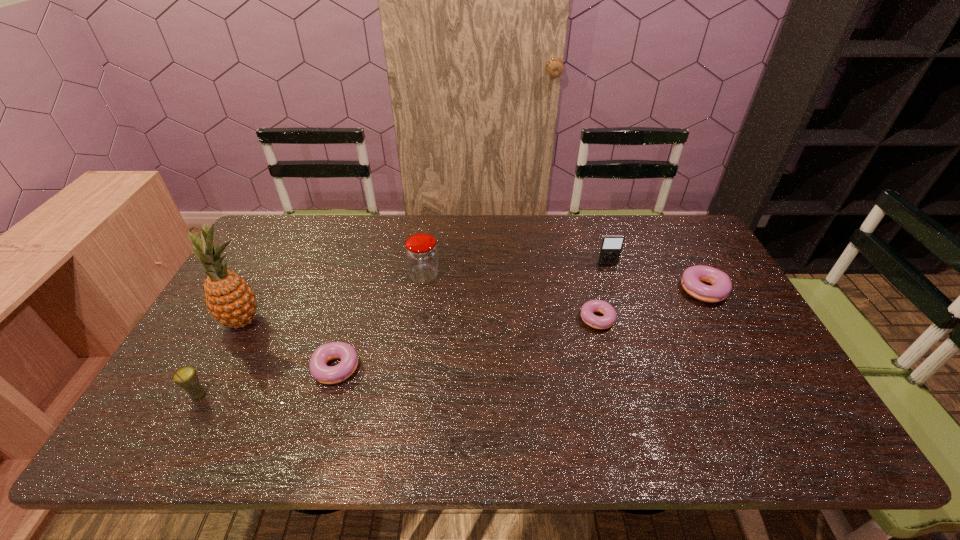
At what (x,y) coordinates should I click in order to perform the action: click on vacant space located 0.280m on the left of the nearest doughnut. Please return your answer as a coordinate pair (x, y). The width and height of the screenshot is (960, 540). Looking at the image, I should click on (203, 368).

Identify the location of free spot located on the left of the shortest doughnut. (488, 316).

This screenshot has height=540, width=960. I want to click on free space located 0.150m on the front of the rightmost doughnut, so click(x=740, y=357).

Where is `vacant region located on the right of the pineapple`? The width and height of the screenshot is (960, 540). vacant region located on the right of the pineapple is located at coordinates (346, 321).

You are a GUI agent. You are given a task and a screenshot of the screen. Output one action in this format:
    pyautogui.click(x=<x>, y=<y>)
    Task: Click on the vacant area situated 0.100m on the left of the jar
    Image resolution: width=960 pixels, height=540 pixels.
    Given the screenshot: What is the action you would take?
    pyautogui.click(x=377, y=276)

Locate an element on the screen. Image resolution: width=960 pixels, height=540 pixels. vacant area situated 0.240m on the front-facing side of the farthest object is located at coordinates (626, 320).

Where is `vacant space located 0.240m on the back of the straw for drinking`? Image resolution: width=960 pixels, height=540 pixels. vacant space located 0.240m on the back of the straw for drinking is located at coordinates coord(243,315).

At what (x,y) coordinates should I click in order to perform the action: click on doughnut at the near edge. Please return your answer as a coordinate pair (x, y). This screenshot has width=960, height=540. Looking at the image, I should click on (319, 370).

This screenshot has height=540, width=960. In order to click on straw for drinking located at the near edge in this screenshot , I will do `click(186, 377)`.

I want to click on pineapple present at the left edge, so click(229, 298).